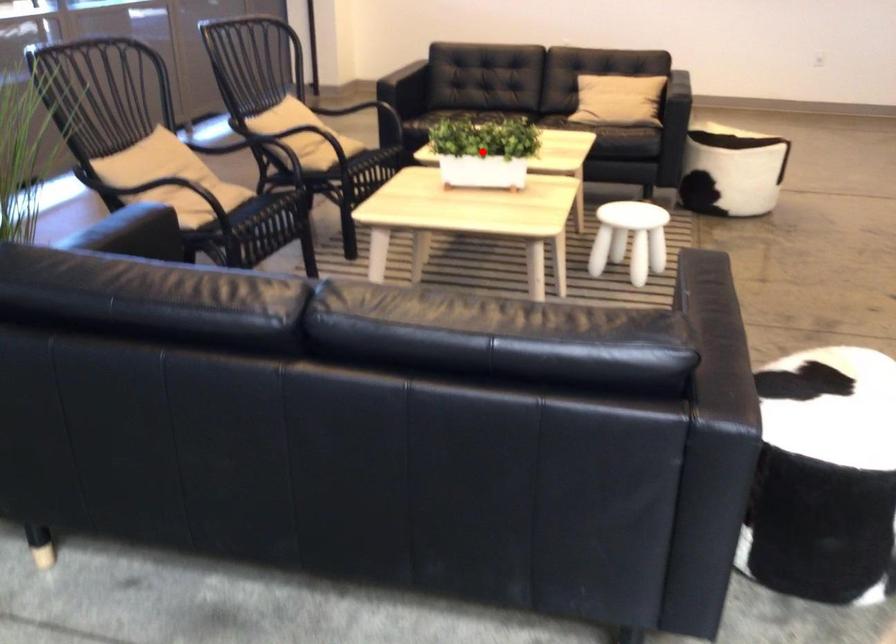
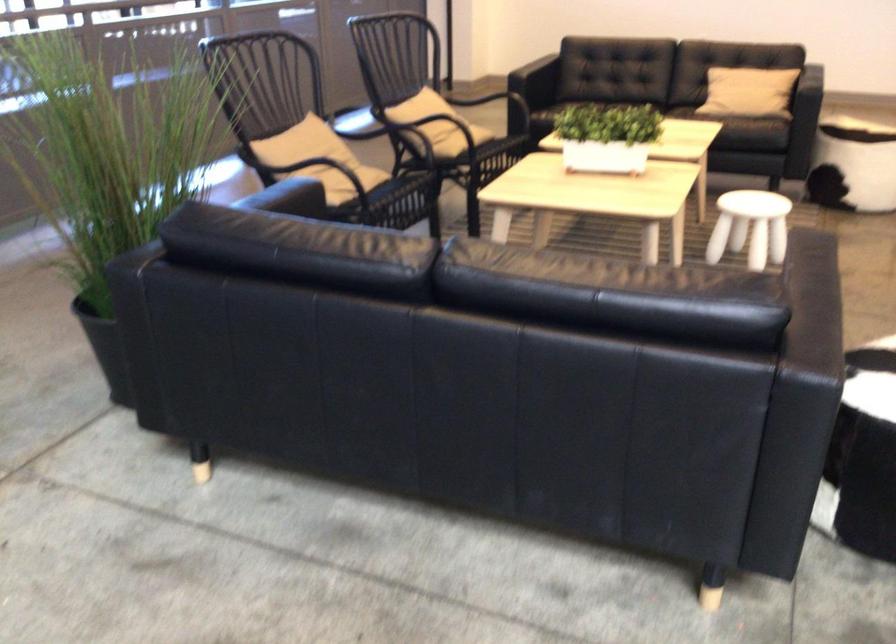
Where in the second image is the point corresponding to the highlighted location from the first image?

(607, 137)